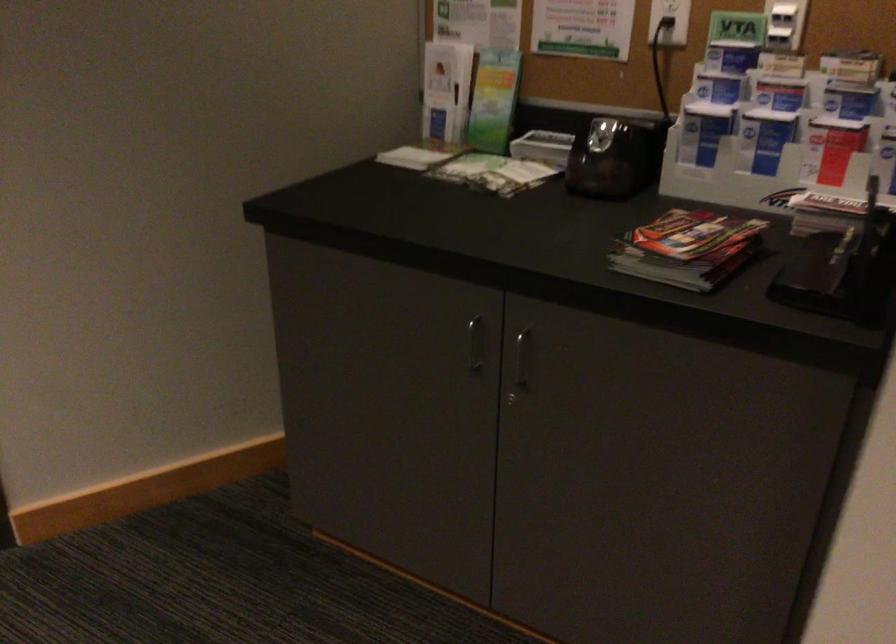
The location [613,158] corresponds to which object?

This point indicates the black pencil sharpener.